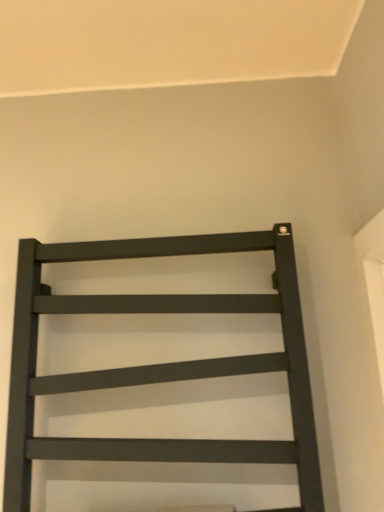
The image size is (384, 512). What do you see at coordinates (158, 364) in the screenshot?
I see `matte black rack at center` at bounding box center [158, 364].

Find the location of `matte black rack at center`. matte black rack at center is located at coordinates (158, 364).

I want to click on matte black rack at center, so click(158, 364).